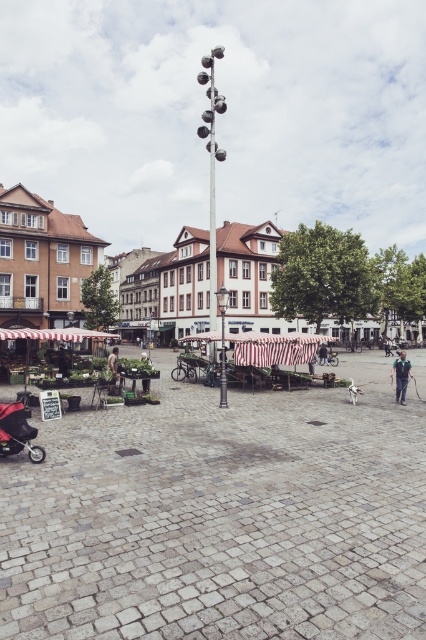
Can you confirm if green fabric jacket at lower right is positioned to the left of dark blue jeans at center?

Incorrect, green fabric jacket at lower right is not on the left side of dark blue jeans at center.

Who is more forward, (402, 394) or (327, 364)?

Positioned in front is point (402, 394).

You are a GUI agent. You are given a task and a screenshot of the screen. Output one action in this format:
    pyautogui.click(x=<x>, y=<y>)
    Task: Click on the green fabric jacket at lower right
    
    Given the screenshot: What is the action you would take?
    pyautogui.click(x=400, y=376)

Which of these two, green fabric jacket at lower right or brown stone square at center, stands shorter?

brown stone square at center

Does green fabric jacket at lower right have a larger size compared to brown stone square at center?

Yes.

Identify the location of green fabric jacket at lower right. Image resolution: width=426 pixels, height=640 pixels. (400, 376).

This screenshot has width=426, height=640. Identify the location of green fabric jacket at lower right. (400, 376).

Based on the photo, between matte black stroller at lower left and green fabric umbrella at lower left, which one is positioned lower?

matte black stroller at lower left is lower down.

Is point (25, 420) closer to camera compared to point (112, 376)?

Yes, point (25, 420) is in front of point (112, 376).

Identify the location of matte black stroller at lower left. The width and height of the screenshot is (426, 640). (17, 433).